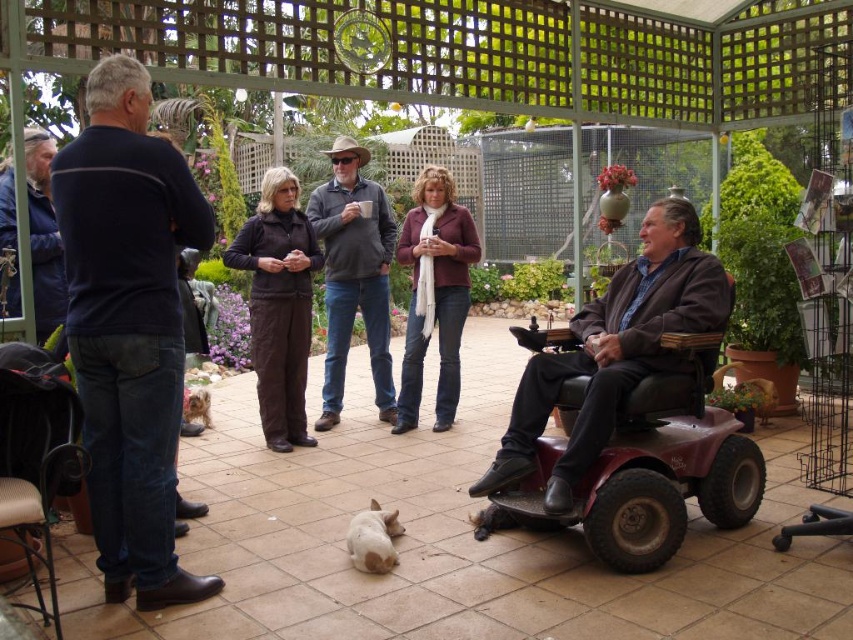
You are standing in the garden and want to greet both the person wearing the dark blue sweater at left and the person wearing the dark gray sweater at center. Which person should you approach first to reach them more quickly?

You should approach the dark blue sweater at left first because it is closer to you than the dark gray sweater at center, so you can reach them more quickly.

You are a photographer trying to capture a group photo of the dark gray sweater at center and the white fur dog at center. The camera frame can only accommodate objects up to 1.2 meters in width. Based on their positions and sizes, will both subjects fit within the frame?

The dark gray sweater at center might be wider than white fur dog at center, but since the camera frame can accommodate up to 1.2 meters, both subjects will likely fit within the frame as long as their combined width does not exceed the limit.